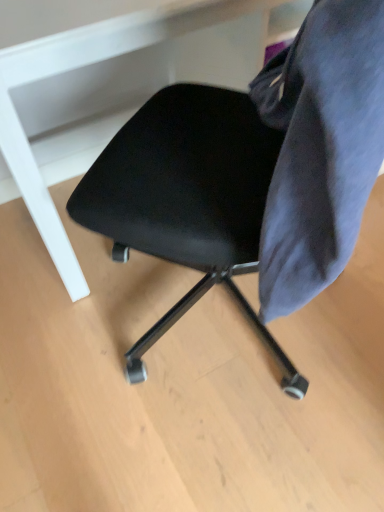
Question: Is point (314, 26) closer or farther from the camera than point (3, 68)?

Choices:
 (A) farther
 (B) closer

Answer: (B)

Question: From the image's perspective, relative to black matte chair at center, is velvet dark blue chair at right above or below?

Choices:
 (A) below
 (B) above

Answer: (A)

Question: Estimate the real-world distances between objects in this image. Which object is farther from the black matte chair at center?

Choices:
 (A) black leather chair at center
 (B) velvet dark blue chair at right

Answer: (B)

Question: Considering the real-world distances, which object is farthest from the black leather chair at center?

Choices:
 (A) black matte chair at center
 (B) velvet dark blue chair at right

Answer: (A)